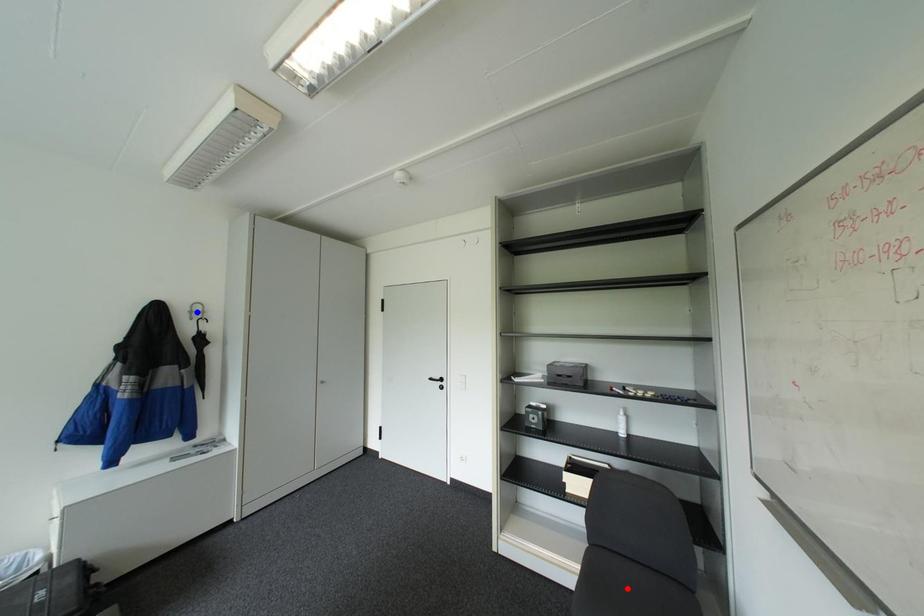
Question: Which of the two points in the image is closer to the camera?

Choices:
 (A) Blue point is closer.
 (B) Red point is closer.

Answer: (B)